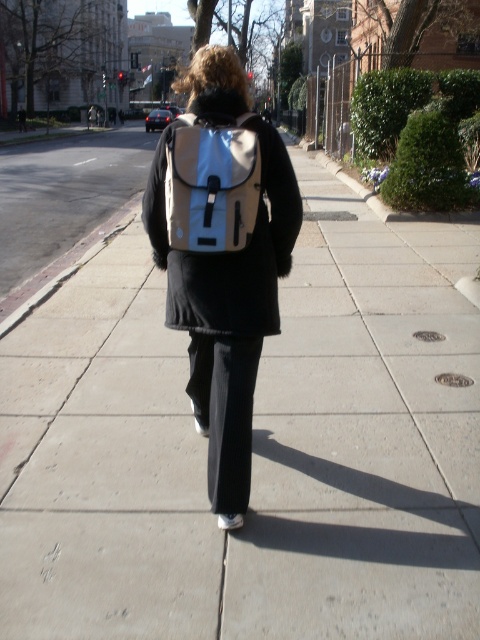
Where is `beige fabric backpack at center`? This screenshot has height=640, width=480. beige fabric backpack at center is located at coordinates (222, 256).

The image size is (480, 640). In order to click on beige fabric backpack at center in this screenshot , I will do `click(222, 256)`.